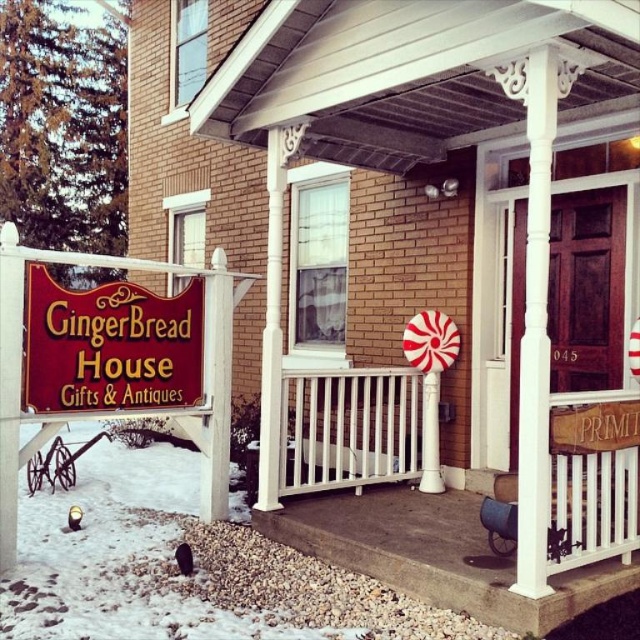
Consider the image. You are standing on the sidewalk in front of the GingerBread House Gifts and Antiques. You see the wooden signboard at lower left and the white carved wood pillar at center. Which object is closer to you?

The wooden signboard at lower left is closer to you because it is further to the viewer than the white carved wood pillar at center.

You are standing at the entrance of the building and want to locate the wooden signboard at lower left. What are the coordinates where you should look?

Result: The wooden signboard at lower left is located at coordinates point (109,346).